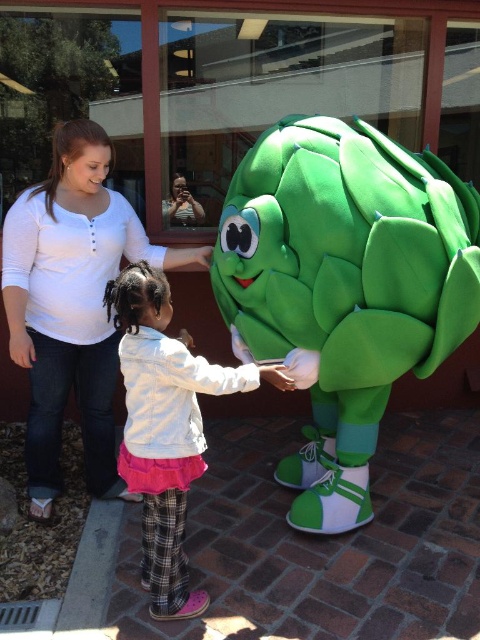
You are standing in the outdoor scene and want to take a photo of the artichoke mascot. There are two points marked in the image, point A at coordinates point (372, 356) and point B at coordinates point (156, 378). Which point is closer to you?

Point A at coordinates point (372, 356) is closer to you because it is further to the camera than point B at coordinates point (156, 378).

From the picture: You are standing in the outdoor area and see the green plush artichoke at center and the white fleece jacket at center. Which object is located to the right?

The green plush artichoke at center is positioned to the right of the white fleece jacket at center.